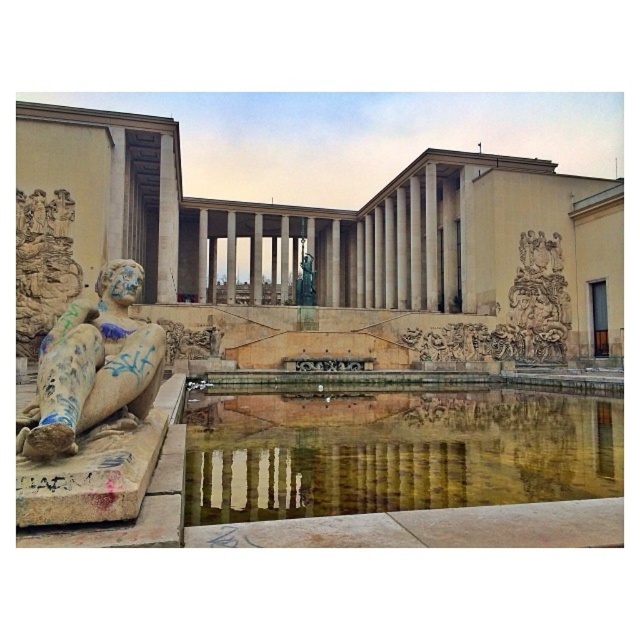
Looking at this image, you are standing in front of the grand building and want to take a photo that includes both the stone statue at left and the reflecting pool. Where should you position yourself to ensure both are visible in the frame?

To include both the stone statue at left and the reflecting pool in your photo, position yourself in the center of the reflecting pool, facing the building. This central position ensures the statue at the left edge and the pool are both within the frame.

In the scene shown: You are an architect visiting this historical site. You notice the reflective stone pool at center and the stone statue at left. Which object appears taller in the image?

The stone statue at left is taller than the reflective stone pool at center.